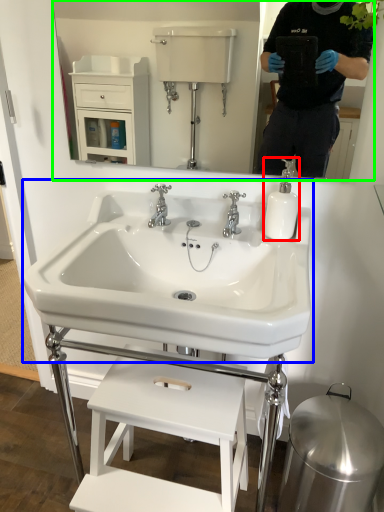
Question: Estimate the real-world distances between objects in this image. Which object is farther from soap dispenser (highlighted by a red box), sink (highlighted by a blue box) or mirror (highlighted by a green box)?

Choices:
 (A) sink
 (B) mirror

Answer: (B)